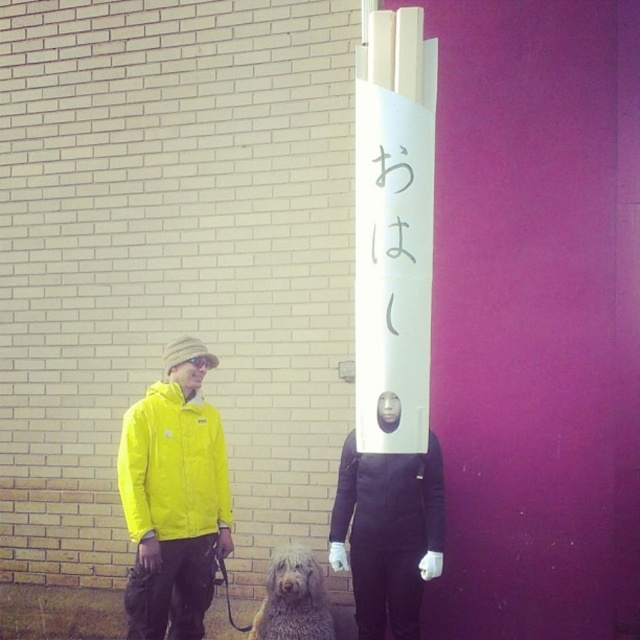
You are a photographer trying to capture both the yellow matte jacket at left and the gray shaggy dog at lower center in the same frame. Based on their positions, which object should you adjust your camera to focus on first to ensure both are in the shot?

The yellow matte jacket at left is to the left of the gray shaggy dog at lower center, so you should focus on the gray shaggy dog at lower center first to ensure both are in the frame.

You are a photographer trying to capture a photo of the black matte jacket at center and the gray shaggy dog at lower center. The camera you are using has a minimum focus distance of 18 inches. Will you be able to focus on both subjects without moving them?

The distance between the black matte jacket at center and the gray shaggy dog at lower center is 17.64 inches, which is less than the camera minimum focus distance of 18 inches. Therefore, the camera cannot focus on both subjects simultaneously without moving them closer together.